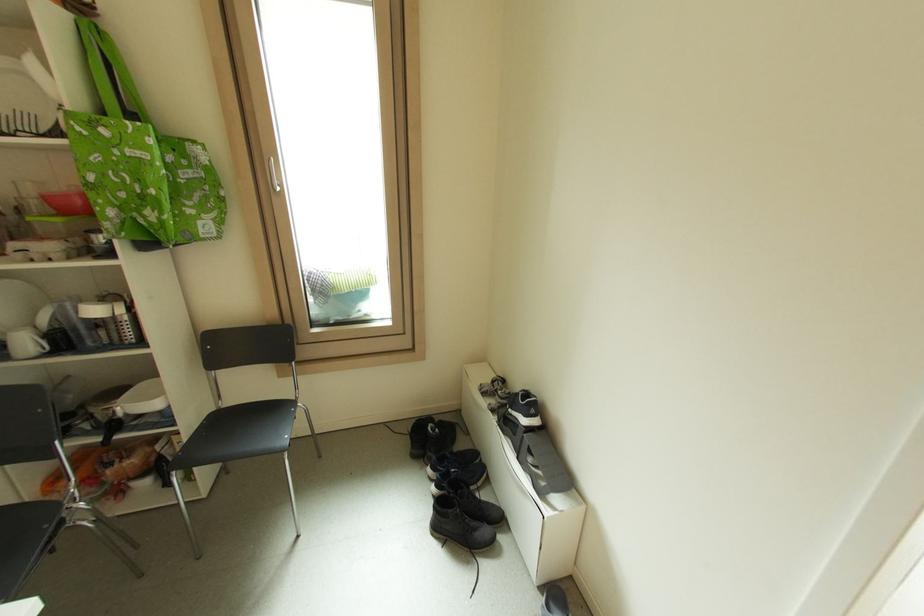
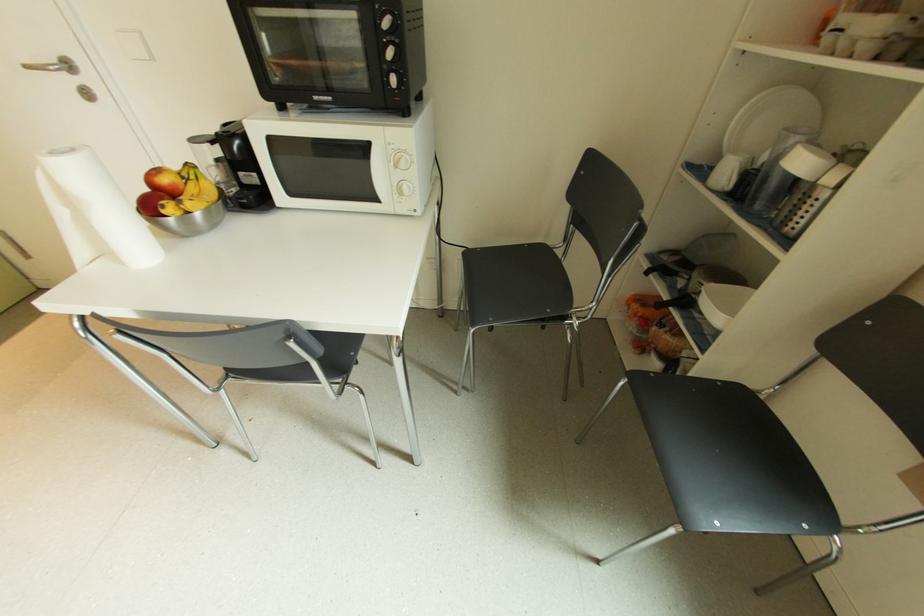
Based on the continuous images, in which direction is the camera rotating?

The camera's rotation is toward left-down.